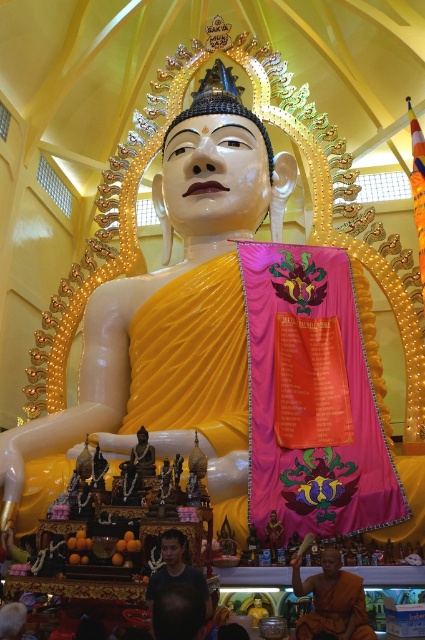
Is point (311, 577) closer to camera compared to point (172, 532)?

That is False.

Who is taller, brown cloth monk at lower center or dark blue shirt at lower center?

With more height is brown cloth monk at lower center.

This screenshot has width=425, height=640. What are the coordinates of `brown cloth monk at lower center` in the screenshot? It's located at (331, 600).